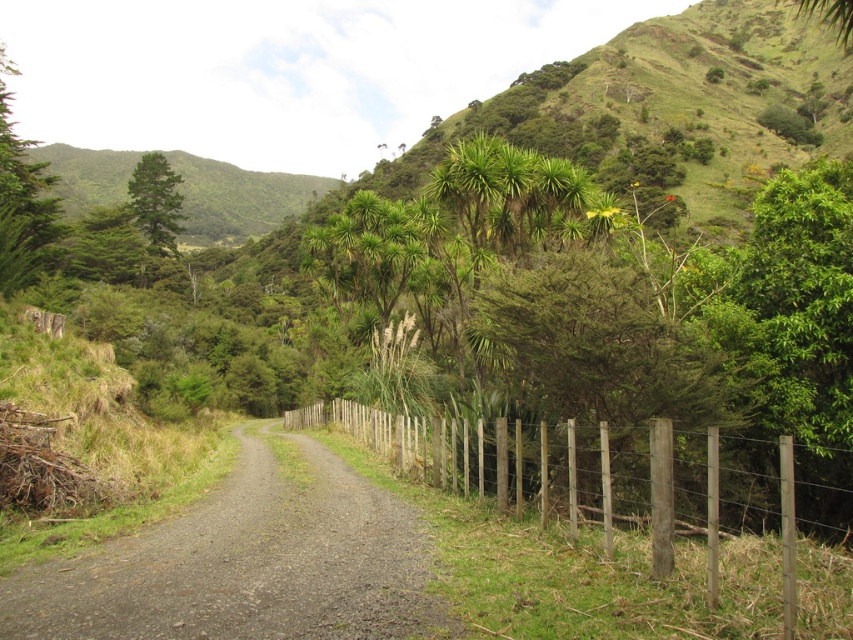
Question: Which point is farther to the camera?

Choices:
 (A) (212, 170)
 (B) (148, 204)
 (C) (573, 611)

Answer: (A)

Question: Which object appears farthest from the camera in this image?

Choices:
 (A) brown wooden fence at center
 (B) gray gravel road at center
 (C) green leafy tree at left

Answer: (C)

Question: Considering the relative positions of brown wooden fence at center and green leafy hillside at upper left in the image provided, where is brown wooden fence at center located with respect to green leafy hillside at upper left?

Choices:
 (A) above
 (B) below

Answer: (B)

Question: Among these objects, which one is farthest from the camera?

Choices:
 (A) green matte tree at upper left
 (B) brown wooden fence at center

Answer: (A)

Question: Can you confirm if gray gravel road at center is positioned to the right of green matte tree at upper left?

Choices:
 (A) no
 (B) yes

Answer: (B)

Question: In this image, where is green leafy hillside at upper left located relative to green leafy tree at left?

Choices:
 (A) below
 (B) above

Answer: (B)